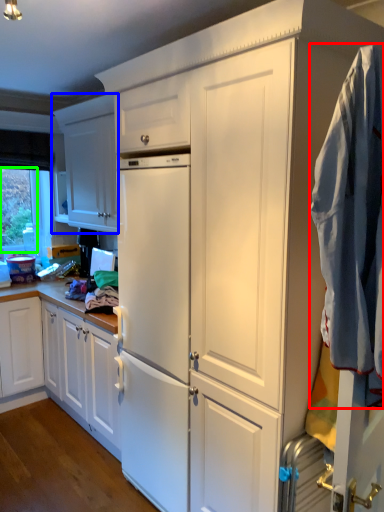
Question: Estimate the real-world distances between objects in this image. Which object is closer to clothing (highlighted by a red box), cabinetry (highlighted by a blue box) or window screen (highlighted by a green box)?

Choices:
 (A) cabinetry
 (B) window screen

Answer: (A)